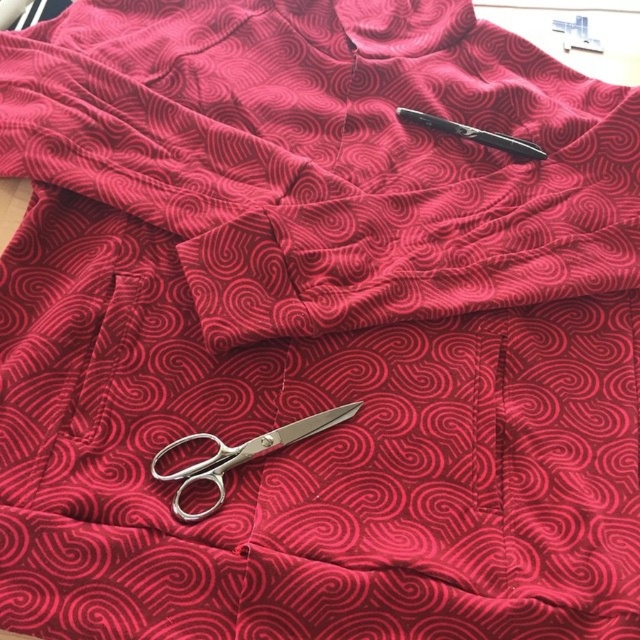
Looking at this image, which of these two, polished silver scissors at center or metallic pen at upper center, stands shorter?

metallic pen at upper center is shorter.

This screenshot has height=640, width=640. I want to click on polished silver scissors at center, so click(x=241, y=456).

Identify the location of polished silver scissors at center. Image resolution: width=640 pixels, height=640 pixels. (241, 456).